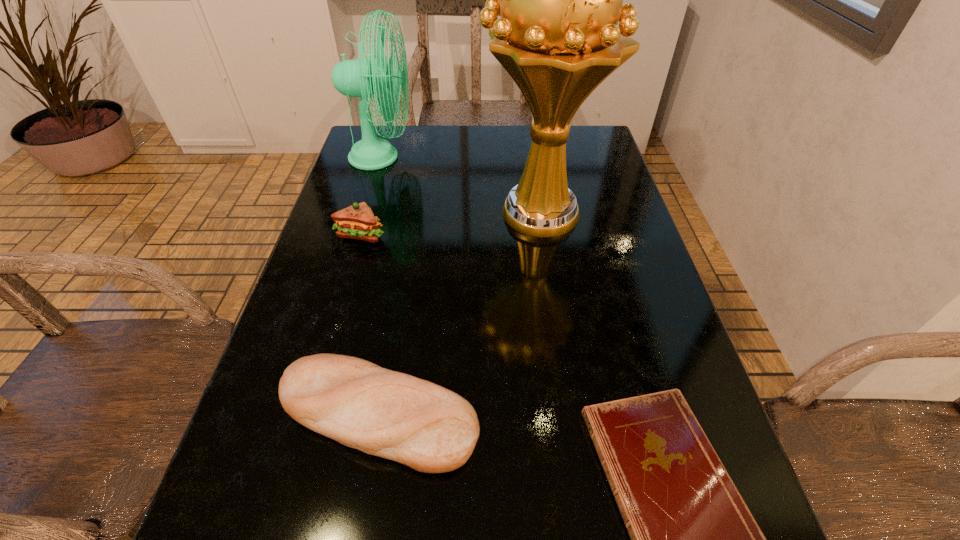
Identify the location of trophy_cup. (560, 0).

Identify the location of fan. The height and width of the screenshot is (540, 960). (360, 78).

Find the location of a particular element. sandwich is located at coordinates (357, 221).

At what (x,y) coordinates should I click in order to perform the action: click on the fourth tallest object. Please return your answer as a coordinate pair (x, y). Looking at the image, I should click on (393, 415).

Identify the location of free space located 0.070m at the front of the tallest object where the globe is prominent. (451, 213).

What are the coordinates of `vacant area situated 0.150m at the front of the tallest object where the globe is prominent` in the screenshot? It's located at (420, 213).

At what (x,y) coordinates should I click in order to perform the action: click on vacant point located 0.060m at the front of the tallest object where the globe is prominent. Please return your answer as a coordinate pair (x, y). The image size is (960, 540). Looking at the image, I should click on (455, 213).

Image resolution: width=960 pixels, height=540 pixels. I want to click on free space located in front of the second tallest object to blow air, so click(437, 157).

You are a GUI agent. You are given a task and a screenshot of the screen. Output one action in this format:
    pyautogui.click(x=<x>, y=<y>)
    Task: Click on the free location located 0.310m on the front of the sandwich
    The image size is (960, 540).
    Given the screenshot: What is the action you would take?
    pyautogui.click(x=324, y=360)

Find the location of a particular element. The image size is (960, 540). vacant space located 0.260m on the right of the bread is located at coordinates (637, 415).